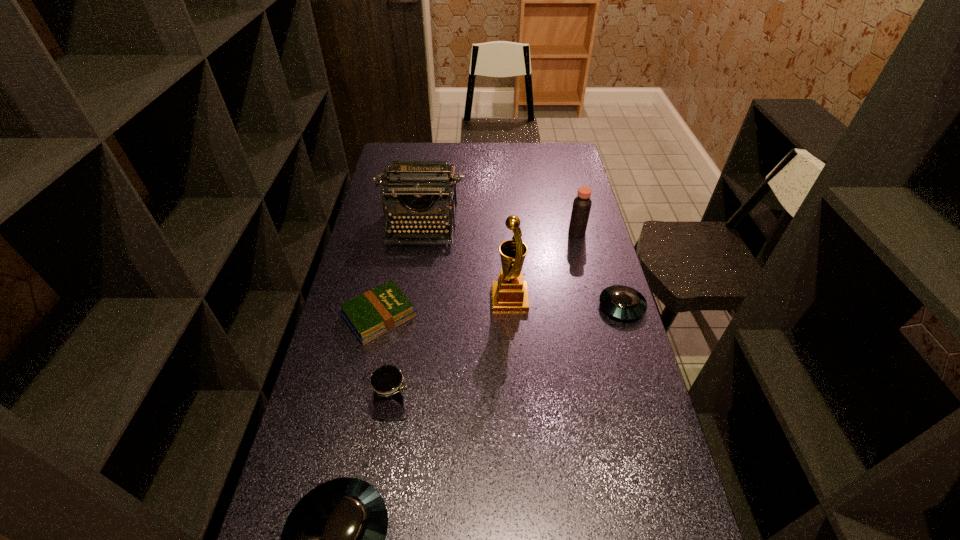
This screenshot has width=960, height=540. Identify the location of vinegar that is at the right edge. (582, 204).

The height and width of the screenshot is (540, 960). I want to click on free space at the far edge, so click(460, 145).

You are a GUI agent. You are given a task and a screenshot of the screen. Output one action in this format:
    pyautogui.click(x=<x>, y=<y>)
    Task: Click on the free location at the left edge
    This screenshot has height=540, width=960.
    Given the screenshot: What is the action you would take?
    pyautogui.click(x=352, y=349)

I want to click on free space at the right edge of the desktop, so click(587, 353).

In order to click on vacant space in between the fifth object from left to right and the typewriter in this screenshot , I will do `click(466, 262)`.

Locate an element on the screen. free area in between the fourth shortest object and the tallest object is located at coordinates (452, 354).

Identify the location of unoccupied area between the fourth tallest object and the book. (387, 362).

At what (x,y) coordinates should I click in order to perform the action: click on vacant space that is in between the jar and the tallest object. Please return your answer as a coordinate pair (x, y). Looking at the image, I should click on (452, 354).

The height and width of the screenshot is (540, 960). Identify the location of free space between the typewriter and the book. (400, 271).

Locate an element on the screen. Image resolution: width=960 pixels, height=540 pixels. free space between the fifth object from left to right and the typewriter is located at coordinates (466, 262).